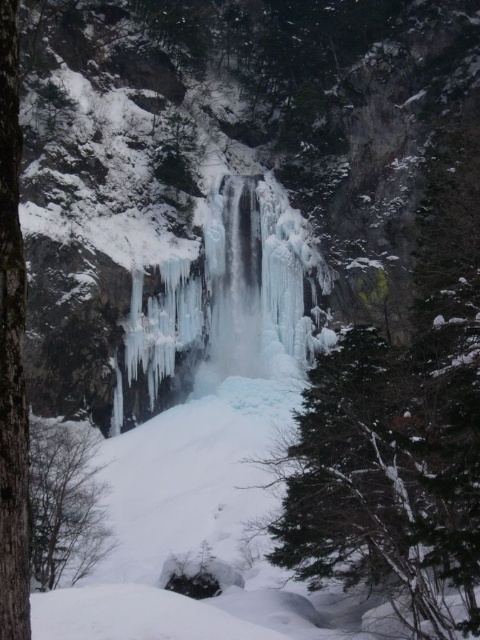
Who is shorter, icy white waterfall at center or brown wood tree at lower left?

Standing shorter between the two is brown wood tree at lower left.

Does icy white waterfall at center have a smaller size compared to brown wood tree at lower left?

No.

Locate an element on the screen. icy white waterfall at center is located at coordinates (233, 294).

Can you confirm if green textured tree at center is positioned above barky brown tree trunk at left?

Actually, green textured tree at center is below barky brown tree trunk at left.

Is green textured tree at center positioned before barky brown tree trunk at left?

No, green textured tree at center is further to the viewer.

What do you see at coordinates (388, 470) in the screenshot? The height and width of the screenshot is (640, 480). I see `green textured tree at center` at bounding box center [388, 470].

Image resolution: width=480 pixels, height=640 pixels. Find the location of `green textured tree at center`. green textured tree at center is located at coordinates (388, 470).

Who is more distant from viewer, (435, 444) or (54, 472)?

Positioned behind is point (54, 472).

Identify the location of green textured tree at center. (388, 470).

Locate an element on the screen. The image size is (480, 640). green textured tree at center is located at coordinates (388, 470).